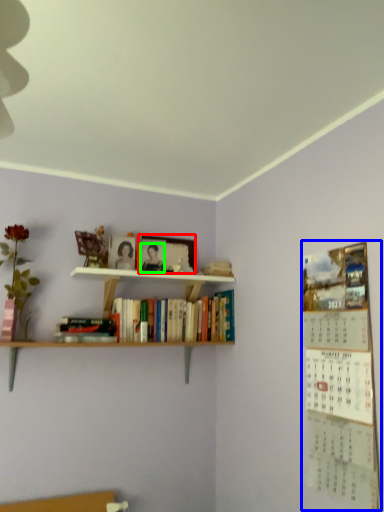
Question: Which is farther away from picture frame (highlighted by a red box)? bulletin board (highlighted by a blue box) or person (highlighted by a green box)?

Choices:
 (A) bulletin board
 (B) person

Answer: (A)